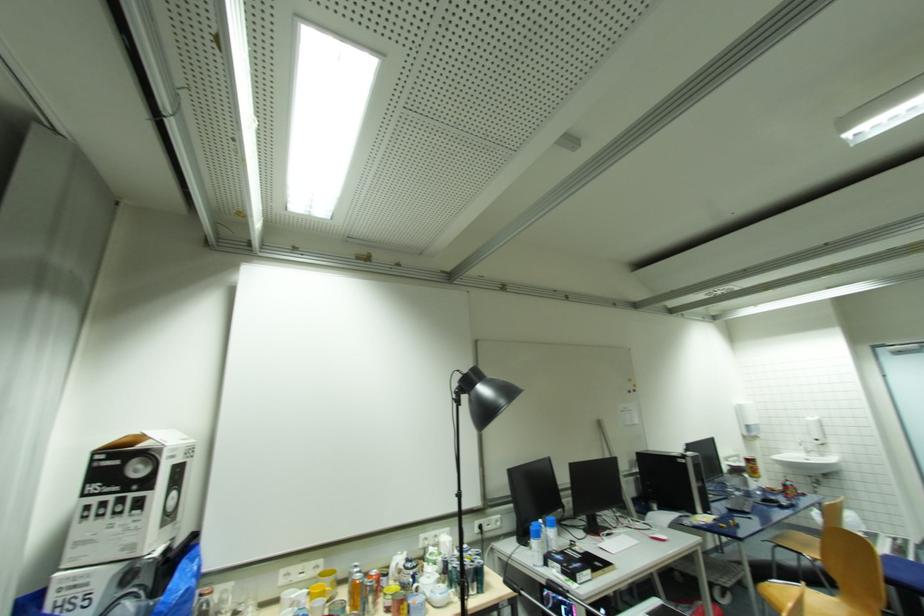
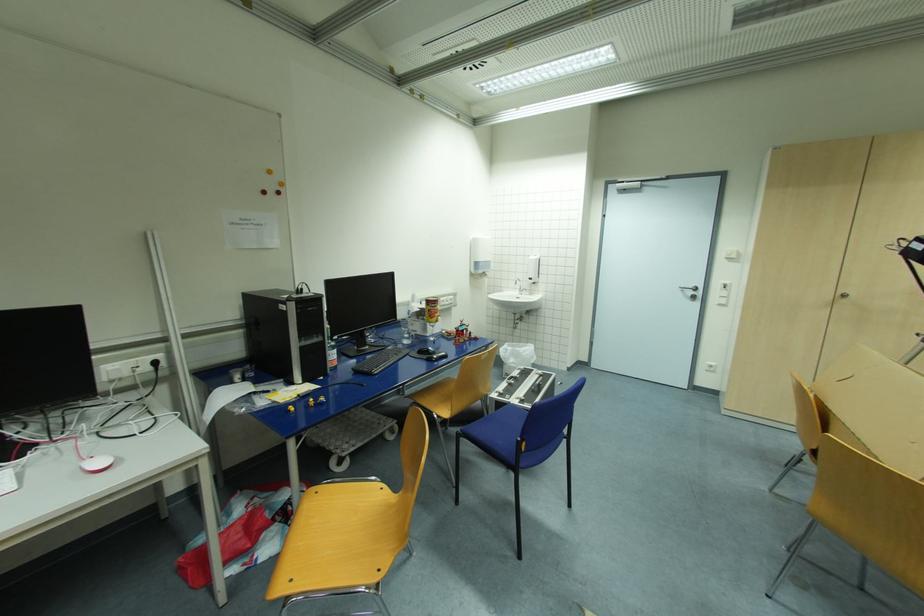
The point at (811, 453) is marked in the first image. Where is the corresponding point in the second image?

(525, 291)